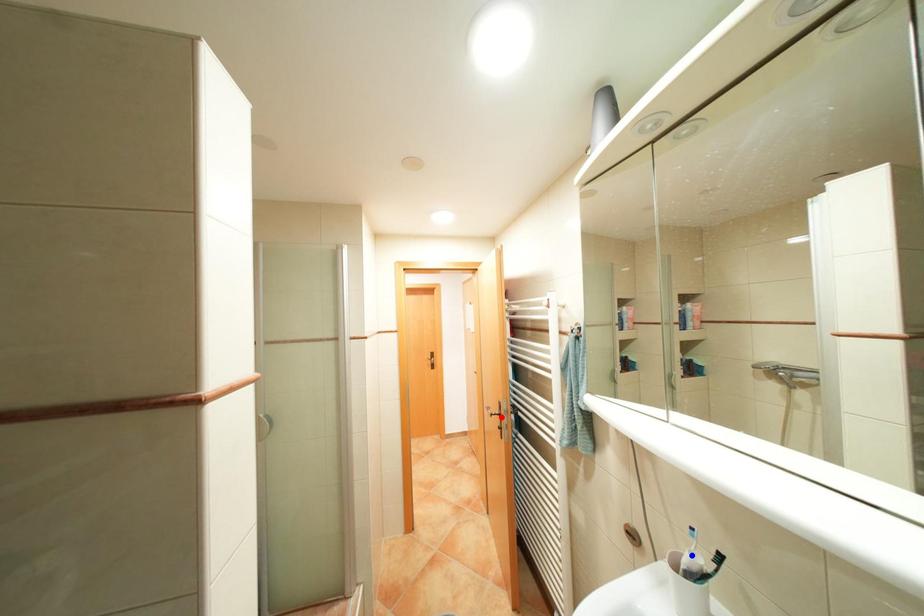
Question: Two points are marked on the image. Which point is closer to the camera?

Choices:
 (A) Blue point is closer.
 (B) Red point is closer.

Answer: (A)